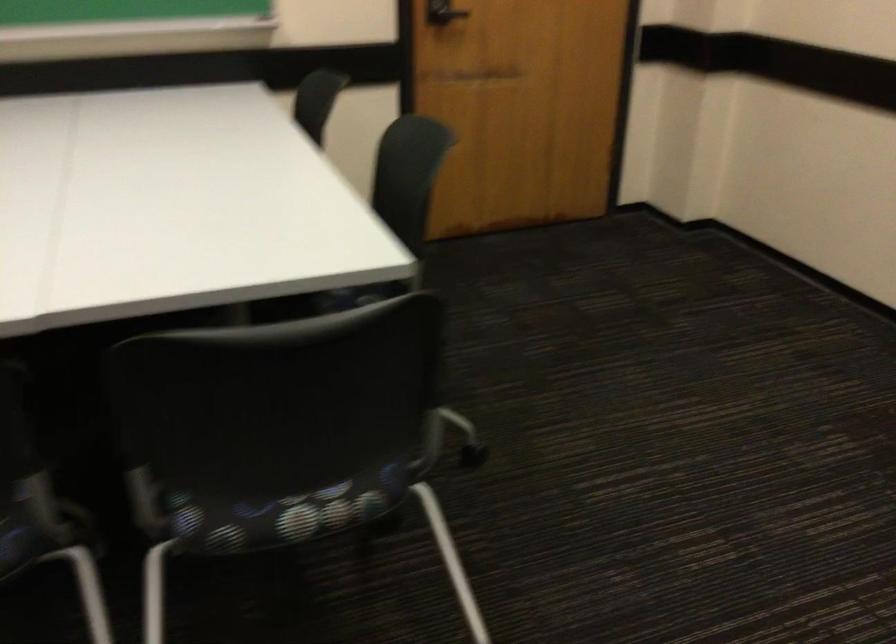
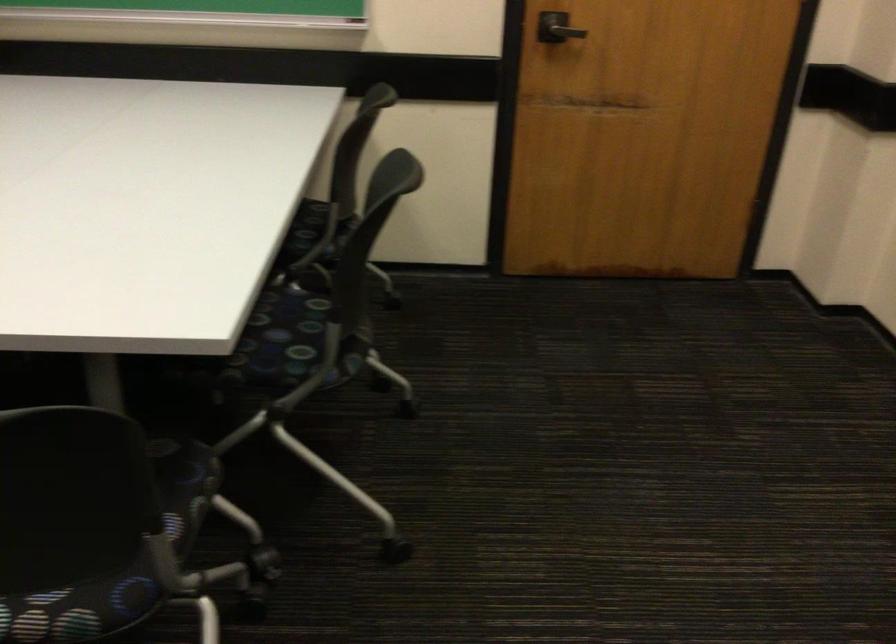
What movement of the cameraman would produce the second image?

The cameraman walked toward right, forward.